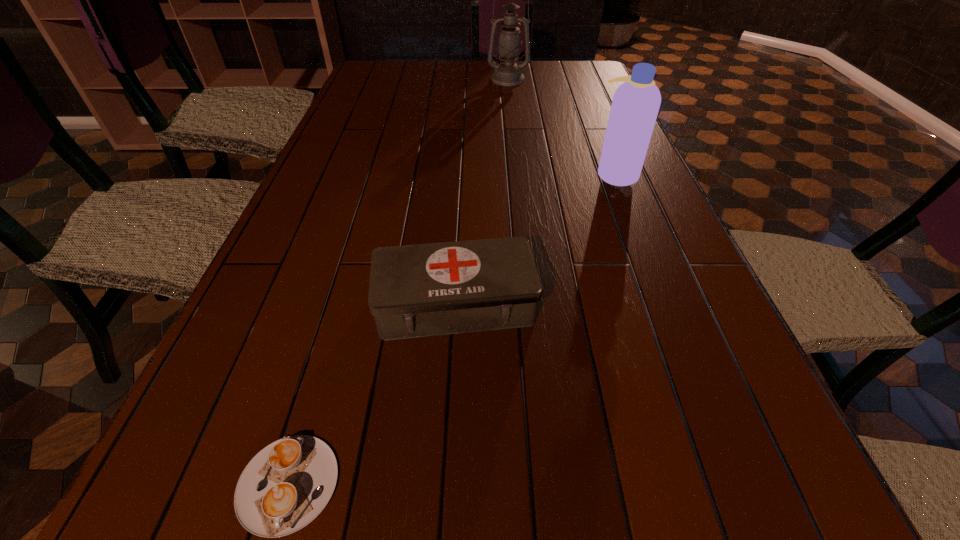
The width and height of the screenshot is (960, 540). Find the location of `the tallest object`. the tallest object is located at coordinates (508, 73).

Where is `oil lamp`? The width and height of the screenshot is (960, 540). oil lamp is located at coordinates (508, 73).

The image size is (960, 540). I want to click on the third nearest object, so (x=635, y=105).

Where is `the second tallest object`? The width and height of the screenshot is (960, 540). the second tallest object is located at coordinates (635, 105).

The width and height of the screenshot is (960, 540). Find the location of `the second shortest object`. the second shortest object is located at coordinates (433, 289).

The width and height of the screenshot is (960, 540). Identify the location of the first-aid kit. (433, 289).

Identify the location of the nearest object. (285, 486).

Locate an element on the screen. the shortest object is located at coordinates (285, 486).

The height and width of the screenshot is (540, 960). What are the coordinates of `free spot located on the back of the tallest object` in the screenshot? It's located at (506, 64).

I want to click on vacant space located 0.310m on the back of the rightmost object, so click(x=591, y=112).